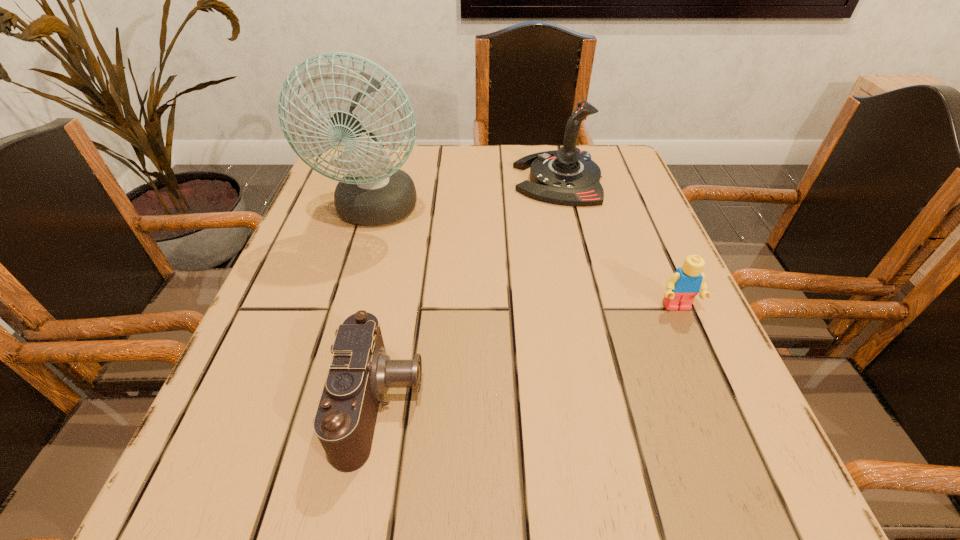
This screenshot has width=960, height=540. What are the coordinates of `free point between the fan and the joystick` in the screenshot? It's located at (467, 195).

The height and width of the screenshot is (540, 960). Find the location of `free spot between the tallest object and the second object from right to left`. free spot between the tallest object and the second object from right to left is located at coordinates (467, 195).

Locate an element on the screen. Image resolution: width=960 pixels, height=540 pixels. free space between the third shortest object and the fan is located at coordinates (467, 195).

The height and width of the screenshot is (540, 960). In order to click on free space between the nearest object and the second object from right to left in this screenshot , I will do `click(469, 291)`.

You are a GUI agent. You are given a task and a screenshot of the screen. Output one action in this format:
    pyautogui.click(x=<x>, y=<y>)
    Task: Click on the blank region between the Lego and the tallest object
    The height and width of the screenshot is (540, 960).
    Given the screenshot: What is the action you would take?
    pyautogui.click(x=526, y=259)

Where is `vacant space that's between the joystick and the nearest object`? Image resolution: width=960 pixels, height=540 pixels. vacant space that's between the joystick and the nearest object is located at coordinates (469, 291).

Find the location of a particular element. Image resolution: width=960 pixels, height=540 pixels. free space between the tallest object and the Lego is located at coordinates (526, 259).

Identify which object is the second nearest to the tallest object. Please provide its 2D coordinates. Your answer should be formatted as a tuple, i.e. [(x, y)], where the tuple contains the x and y coordinates of a point satisfying the conditions above.

[(360, 372)]

Locate an element on the screen. The height and width of the screenshot is (540, 960). object that is the second closest one to the nearest object is located at coordinates (682, 286).

The image size is (960, 540). I want to click on vacant space that satisfies the following two spatial constraints: 1. on the handle side of the joystick; 2. in front of the tallest object where the airflow is directed, so click(565, 212).